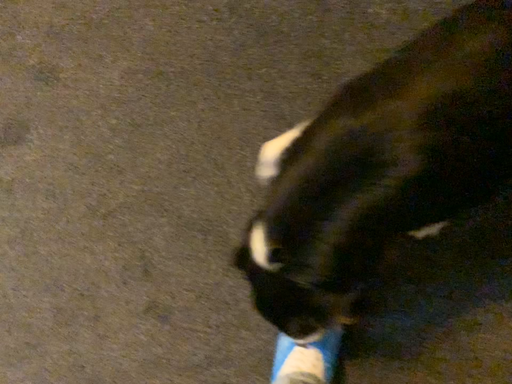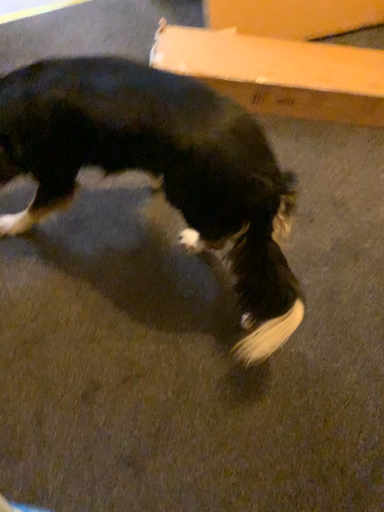
Question: Which way did the camera rotate in the video?

Choices:
 (A) rotated upward
 (B) rotated downward

Answer: (A)